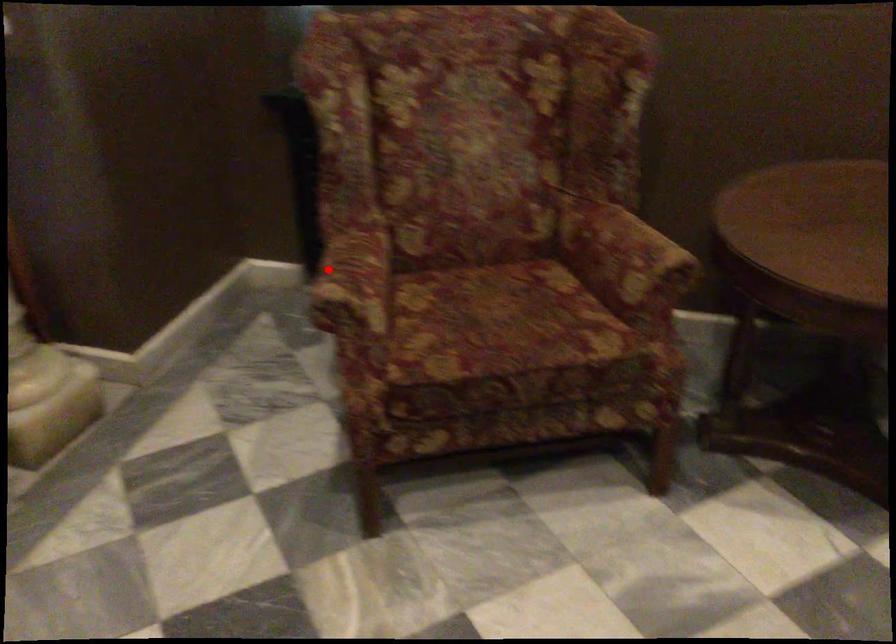
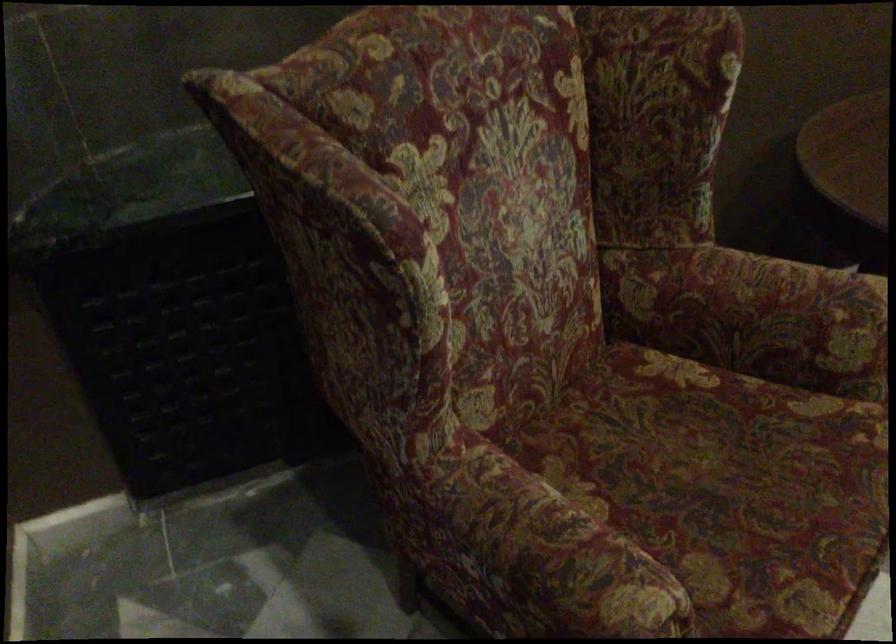
Question: I am providing you with two images of the same scene from different viewpoints. In image1, a red point is highlighted. Considering the same 3D point in image2, which of the following is correct?

Choices:
 (A) It is closer
 (B) It is farther

Answer: (A)